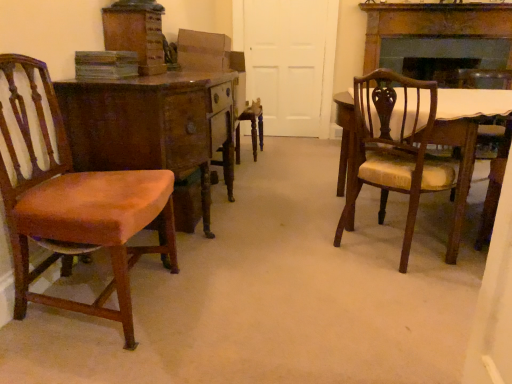
Identify the location of free space above white matte door at center (from a real-world perspective). The image size is (512, 384). (283, 0).